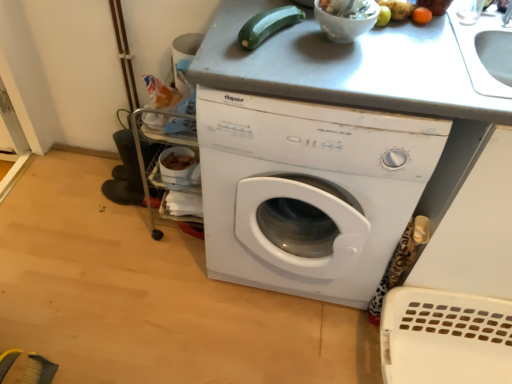
Find the location of a particular element. white plastic washing machine at center is located at coordinates (308, 191).

At what (x,y) coordinates should I click in order to perform the action: click on white glossy bowl at upper center. Please return your answer as a coordinate pair (x, y). The width and height of the screenshot is (512, 384). Looking at the image, I should click on (347, 19).

What are the coordinates of `orange matte fruit at upper right, the second vegetable from the left` in the screenshot? It's located at (421, 16).

Where is `white plastic washing machine at center`? The image size is (512, 384). white plastic washing machine at center is located at coordinates (308, 191).

From the image's perspective, which is above, white glossy bowl at upper center or white glossy bowl at upper center?

white glossy bowl at upper center, from the image's perspective.

Does white glossy bowl at upper center have a greater width compared to white glossy bowl at upper center?

Incorrect, the width of white glossy bowl at upper center does not surpass that of white glossy bowl at upper center.

Which is farther, (329, 0) or (356, 35)?

The point (356, 35) is more distant.

Is white glossy bowl at upper center to the right of white glossy bowl at upper center from the viewer's perspective?

Correct, you'll find white glossy bowl at upper center to the right of white glossy bowl at upper center.

From a real-world perspective, is orange matte fruit at upper right, the second vegetable from the left, located higher than white glossy bowl at upper center?

Incorrect, from a real-world perspective, orange matte fruit at upper right, the second vegetable from the left, is lower than white glossy bowl at upper center.

Which object is further away from the camera taking this photo, orange matte fruit at upper right, the 1th vegetable when ordered from right to left, or white glossy bowl at upper center?

orange matte fruit at upper right, the 1th vegetable when ordered from right to left, is further from the camera.

This screenshot has height=384, width=512. I want to click on food positioned vertically above the orange matte fruit at upper right, the 1th vegetable when ordered from right to left (from a real-world perspective), so click(x=348, y=8).

From the image's perspective, which one is positioned higher, orange matte fruit at upper right, the 1th vegetable when ordered from right to left, or white glossy bowl at upper center?

From the image's view, orange matte fruit at upper right, the 1th vegetable when ordered from right to left, is above.

The image size is (512, 384). I want to click on washing machine below the green matte zucchini at upper center, which ranks as the 1th vegetable in left-to-right order (from the image's perspective), so click(x=308, y=191).

Considering the relative positions of green matte zucchini at upper center, the 2th vegetable from the right, and white plastic washing machine at center in the image provided, is green matte zucchini at upper center, the 2th vegetable from the right, to the left or to the right of white plastic washing machine at center?

green matte zucchini at upper center, the 2th vegetable from the right, is to the left of white plastic washing machine at center.

Would you say green matte zucchini at upper center, the 2th vegetable from the right, is inside or outside white plastic washing machine at center?

green matte zucchini at upper center, the 2th vegetable from the right, is outside white plastic washing machine at center.

Can you confirm if green matte zucchini at upper center, which ranks as the 1th vegetable in left-to-right order, is shorter than white plastic washing machine at center?

Yes, green matte zucchini at upper center, which ranks as the 1th vegetable in left-to-right order, is shorter than white plastic washing machine at center.

Is orange matte fruit at upper right, the 1th vegetable when ordered from right to left, positioned far away from white plastic washing machine at center?

They are positioned close to each other.

What's the angular difference between orange matte fruit at upper right, the second vegetable from the left, and white plastic washing machine at center's facing directions?

They differ by 0.976 degrees in their facing directions.

From the picture: Considering the sizes of objects orange matte fruit at upper right, the 1th vegetable when ordered from right to left, and white plastic washing machine at center in the image provided, who is smaller, orange matte fruit at upper right, the 1th vegetable when ordered from right to left, or white plastic washing machine at center?

orange matte fruit at upper right, the 1th vegetable when ordered from right to left, is smaller.

Consider the image. Is orange matte fruit at upper right, the second vegetable from the left, at the left side of white plastic washing machine at center?

No, orange matte fruit at upper right, the second vegetable from the left, is not to the left of white plastic washing machine at center.

Which is in front, point (343, 1) or point (373, 226)?

The point (343, 1) is in front.

This screenshot has width=512, height=384. I want to click on mixing bowl behind the white plastic washing machine at center, so click(347, 19).

From the image's perspective, does white glossy bowl at upper center appear higher than white plastic washing machine at center?

Indeed, from the image's perspective, white glossy bowl at upper center is shown above white plastic washing machine at center.

Is white plastic washing machine at center completely or partially inside white glossy bowl at upper center?

No.

This screenshot has width=512, height=384. Identify the location of food that is above the green matte zucchini at upper center, the 2th vegetable from the right (from a real-world perspective). (348, 8).

Is white glossy bowl at upper center positioned behind green matte zucchini at upper center, the 2th vegetable from the right?

No.

From the image's perspective, which one is positioned lower, white glossy bowl at upper center or green matte zucchini at upper center, the 2th vegetable from the right?

From the image's view, green matte zucchini at upper center, the 2th vegetable from the right, is below.

Is white glossy bowl at upper center not within white plastic washing machine at center?

Absolutely, white glossy bowl at upper center is external to white plastic washing machine at center.

How different are the orientations of white glossy bowl at upper center and white plastic washing machine at center in degrees?

The angular difference between white glossy bowl at upper center and white plastic washing machine at center is 0.348 degrees.

Between white glossy bowl at upper center and white plastic washing machine at center, which one has smaller width?

Thinner between the two is white glossy bowl at upper center.

Which is closer to the camera, [368,1] or [246,152]?

Point [368,1] appears to be closer to the viewer than point [246,152].

At what (x,y) coordinates should I click in order to perform the action: click on food that appears above the white glossy bowl at upper center (from a real-world perspective). Please return your answer as a coordinate pair (x, y). The height and width of the screenshot is (384, 512). Looking at the image, I should click on (348, 8).

Identify the location of food lying on the left of orange matte fruit at upper right, the 1th vegetable when ordered from right to left. This screenshot has width=512, height=384. (348, 8).

Considering their positions, is white glossy bowl at upper center positioned further to green matte zucchini at upper center, which ranks as the 1th vegetable in left-to-right order, than white plastic washing machine at center?

white plastic washing machine at center lies further to green matte zucchini at upper center, which ranks as the 1th vegetable in left-to-right order, than the other object.

When comparing their distances from orange matte fruit at upper right, the second vegetable from the left, does white glossy bowl at upper center or green matte zucchini at upper center, which ranks as the 1th vegetable in left-to-right order, seem further?

The object further to orange matte fruit at upper right, the second vegetable from the left, is green matte zucchini at upper center, which ranks as the 1th vegetable in left-to-right order.

Based on their spatial positions, is green matte zucchini at upper center, the 2th vegetable from the right, or white glossy bowl at upper center further from white glossy bowl at upper center?

green matte zucchini at upper center, the 2th vegetable from the right, is further to white glossy bowl at upper center.

Considering their positions, is white glossy bowl at upper center positioned closer to white glossy bowl at upper center than orange matte fruit at upper right, the second vegetable from the left?

white glossy bowl at upper center is positioned closer to the anchor white glossy bowl at upper center.

From the image, which object appears to be farther from orange matte fruit at upper right, the 1th vegetable when ordered from right to left, white plastic washing machine at center or white glossy bowl at upper center?

The object further to orange matte fruit at upper right, the 1th vegetable when ordered from right to left, is white plastic washing machine at center.

Estimate the real-world distances between objects in this image. Which object is closer to orange matte fruit at upper right, the 1th vegetable when ordered from right to left, green matte zucchini at upper center, the 2th vegetable from the right, or white glossy bowl at upper center?

Among the two, white glossy bowl at upper center is located nearer to orange matte fruit at upper right, the 1th vegetable when ordered from right to left.

Which object lies nearer to the anchor point white glossy bowl at upper center, green matte zucchini at upper center, the 2th vegetable from the right, or orange matte fruit at upper right, the second vegetable from the left?

The object closer to white glossy bowl at upper center is green matte zucchini at upper center, the 2th vegetable from the right.

When comparing their distances from white glossy bowl at upper center, does orange matte fruit at upper right, the second vegetable from the left, or white plastic washing machine at center seem closer?

The object closer to white glossy bowl at upper center is orange matte fruit at upper right, the second vegetable from the left.

At what (x,y) coordinates should I click in order to perform the action: click on food between orange matte fruit at upper right, the second vegetable from the left, and white plastic washing machine at center, in the vertical direction. Please return your answer as a coordinate pair (x, y). The width and height of the screenshot is (512, 384). Looking at the image, I should click on pyautogui.click(x=348, y=8).

Where is `mixing bowl situated between green matte zucchini at upper center, which ranks as the 1th vegetable in left-to-right order, and orange matte fruit at upper right, the second vegetable from the left, from left to right`? The height and width of the screenshot is (384, 512). mixing bowl situated between green matte zucchini at upper center, which ranks as the 1th vegetable in left-to-right order, and orange matte fruit at upper right, the second vegetable from the left, from left to right is located at coordinates (347, 19).

Identify the location of mixing bowl that lies between green matte zucchini at upper center, the 2th vegetable from the right, and white plastic washing machine at center from top to bottom. (347, 19).

Where is `food between green matte zucchini at upper center, which ranks as the 1th vegetable in left-to-right order, and orange matte fruit at upper right, the second vegetable from the left, in the horizontal direction`? food between green matte zucchini at upper center, which ranks as the 1th vegetable in left-to-right order, and orange matte fruit at upper right, the second vegetable from the left, in the horizontal direction is located at coordinates (348, 8).